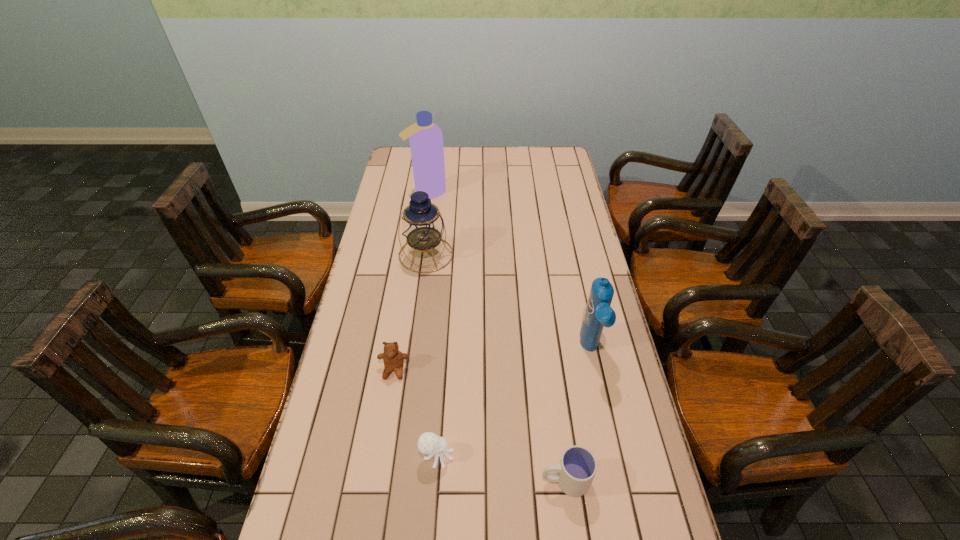
The width and height of the screenshot is (960, 540). Find the location of `vacant area that lies between the rightmost object and the taller shampoo`. vacant area that lies between the rightmost object and the taller shampoo is located at coordinates (509, 271).

The height and width of the screenshot is (540, 960). What are the coordinates of `vacant point located between the cup and the teddy bear` in the screenshot? It's located at pyautogui.click(x=480, y=425).

Identify which object is the closest to the teddy bear. Please provide its 2D coordinates. Your answer should be formatted as a tuple, i.e. [(x, y)], where the tuple contains the x and y coordinates of a point satisfying the conditions above.

[(428, 443)]

Locate an element on the screen. the closest object relative to the lantern is located at coordinates (426, 139).